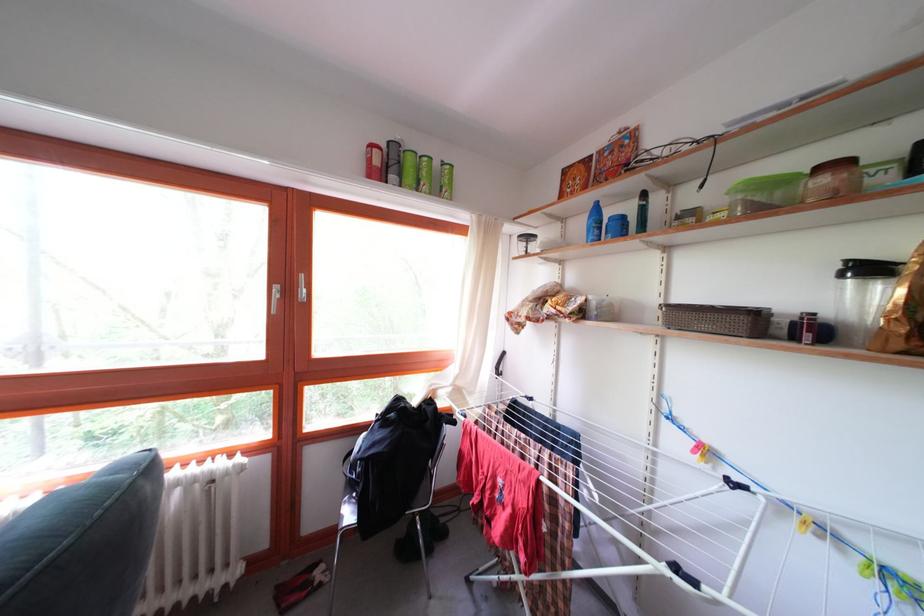
Where is `red cylindrical can`? This screenshot has height=616, width=924. red cylindrical can is located at coordinates (373, 161).